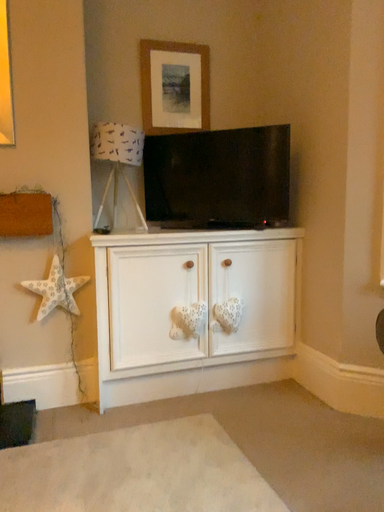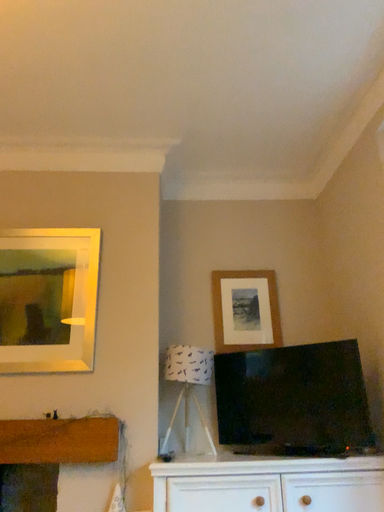
Question: Which way did the camera rotate in the video?

Choices:
 (A) rotated right
 (B) rotated left

Answer: (B)